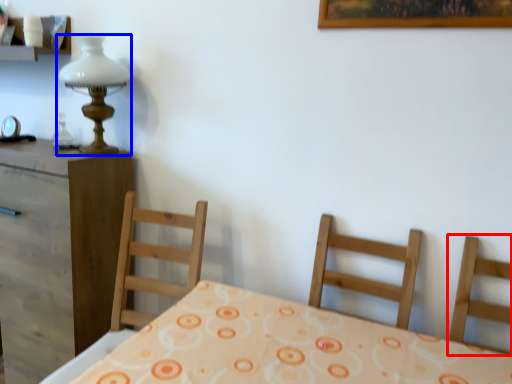
Question: Which object appears farthest to the camera in this image, chair (highlighted by a red box) or table lamp (highlighted by a blue box)?

Choices:
 (A) chair
 (B) table lamp

Answer: (B)